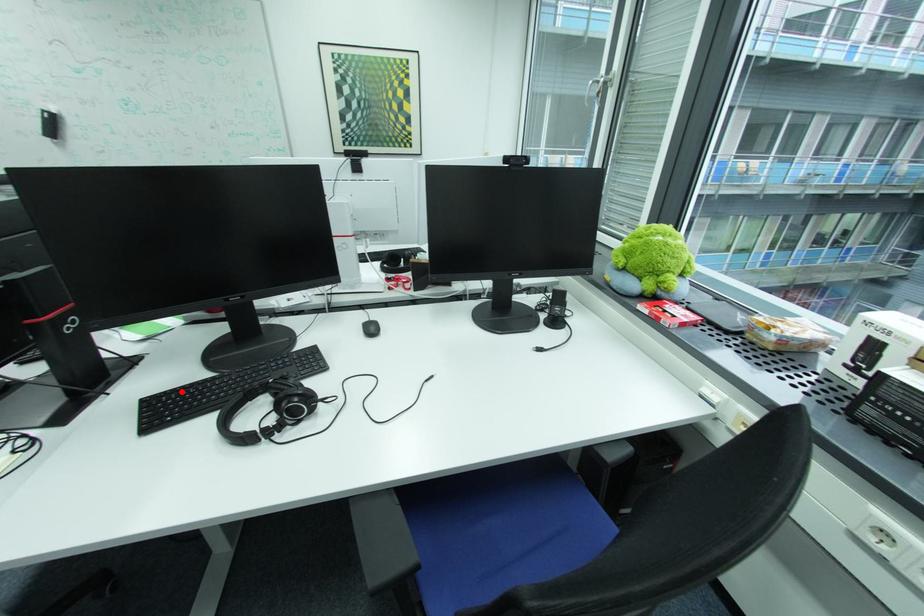
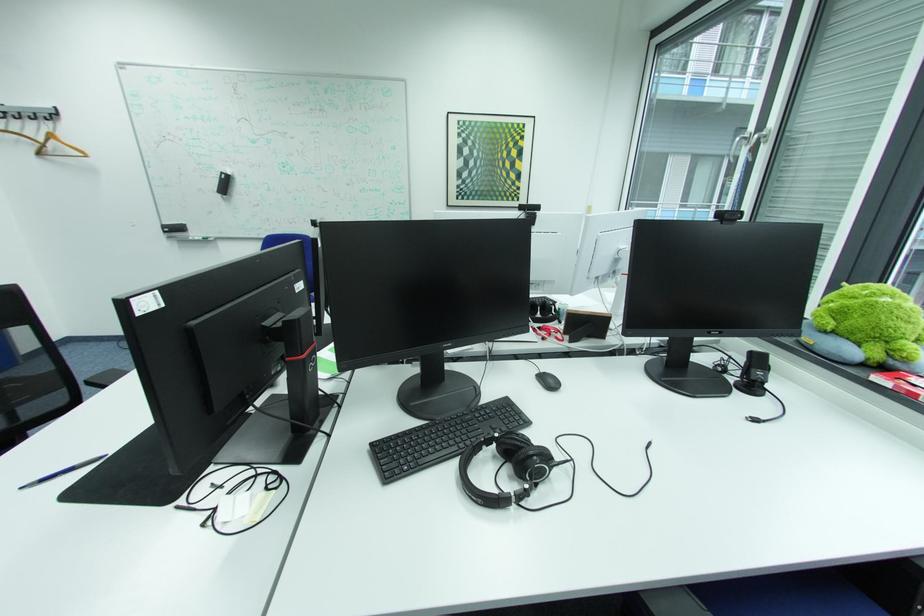
Where in the second image is the point corresponding to the highlighted location from the first image?

(406, 437)